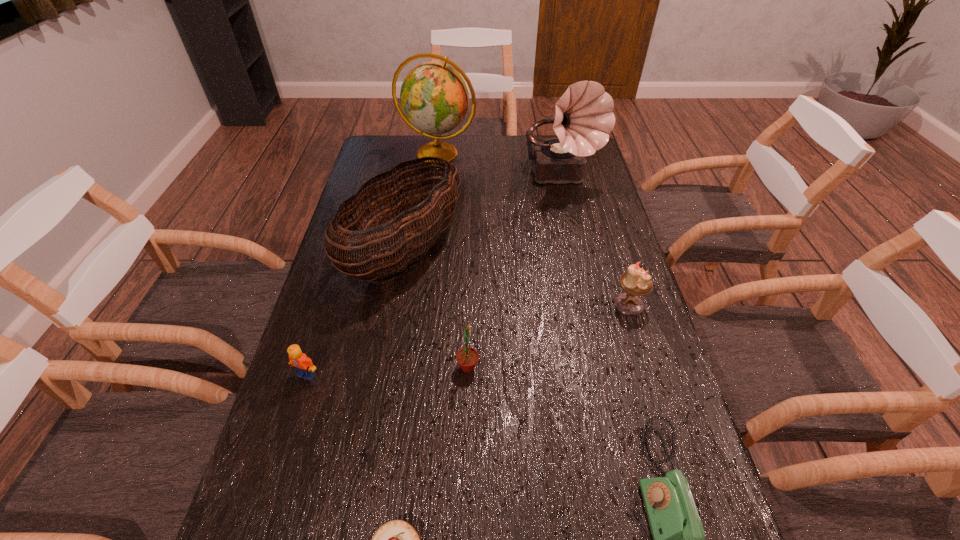
Where is `globe`? globe is located at coordinates (434, 98).

Image resolution: width=960 pixels, height=540 pixels. I want to click on record player, so click(584, 118).

This screenshot has height=540, width=960. Identify the location of the third tallest object. (406, 241).

Where is `candle holder`? This screenshot has height=540, width=960. candle holder is located at coordinates (635, 282).

Identify the location of sunflower. This screenshot has height=540, width=960. (467, 358).

This screenshot has height=540, width=960. Identify the location of the third shortest object. (305, 369).

At what (x,y) coordinates should I click in order to perform the action: click on vacant space located 0.390m on the right of the globe. Please return your answer as a coordinate pair (x, y). The width and height of the screenshot is (960, 540). Looking at the image, I should click on click(576, 153).

Identify the location of vacant point located 0.270m from the horn of the record player. (580, 254).

This screenshot has width=960, height=540. Identify the location of vacant space located on the right of the third tallest object. (511, 251).

At what (x,y) coordinates should I click in order to perform the action: click on vacant region located on the front of the candle holder. Please return your answer as a coordinate pair (x, y). Image resolution: width=960 pixels, height=540 pixels. Looking at the image, I should click on pos(644,354).